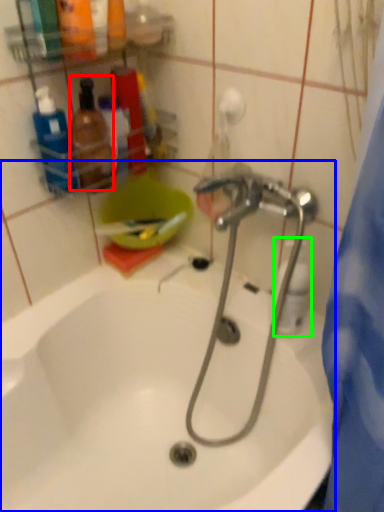
Question: Which is nearer to the toiletry (highlighted by a red box)? bathtub (highlighted by a blue box) or cleaning product (highlighted by a green box).

Choices:
 (A) bathtub
 (B) cleaning product

Answer: (B)